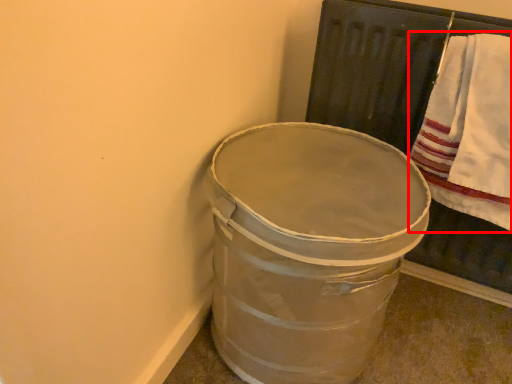
Question: Where is bath towel (annotated by the red box) located in relation to waste container in the image?

Choices:
 (A) right
 (B) left

Answer: (A)